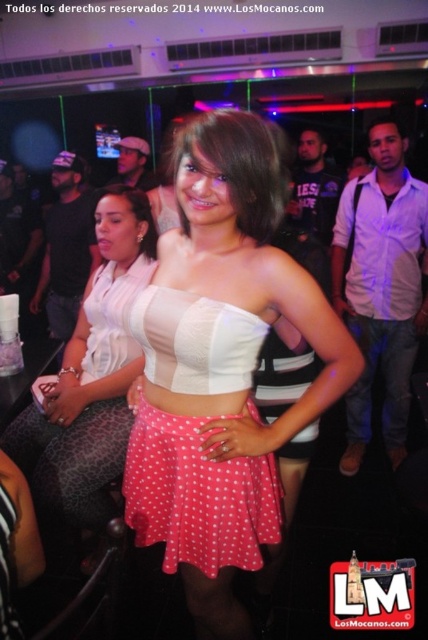
You are a fashion designer observing the image. You need to determine which item of clothing has a greater surface area between the white matte top at center and the jeans at center. Which one do you think it is?

The white matte top at center has a larger size compared to jeans at center, so the white matte top at center has a greater surface area.

You are a photographer taking a picture of the pink polka dot skirt at center and the jeans at center. Which one will appear larger in your photo?

The pink polka dot skirt at center is closer to the viewer than jeans at center, so it will appear larger in the photo.